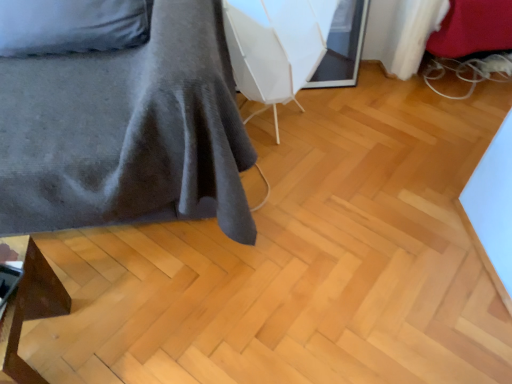
Question: Based on their positions, is velvet grey bedspread at left, the 1th furniture in the top-to-bottom sequence, located to the left or right of white plastic swivel chair at center?

Choices:
 (A) left
 (B) right

Answer: (A)

Question: Is velvet grey bedspread at left, positioned as the second furniture in bottom-to-top order, taller or shorter than white plastic swivel chair at center?

Choices:
 (A) tall
 (B) short

Answer: (A)

Question: Estimate the real-world distances between objects in this image. Which object is farther from the velvet grey bedspread at left, the 1th furniture in the top-to-bottom sequence?

Choices:
 (A) matte brown wooden stool at lower left, the first furniture ordered from the bottom
 (B) white plastic swivel chair at center

Answer: (A)

Question: Considering the real-world distances, which object is closest to the white plastic swivel chair at center?

Choices:
 (A) velvet grey bedspread at left, the 1th furniture in the top-to-bottom sequence
 (B) matte brown wooden stool at lower left, the first furniture ordered from the bottom

Answer: (A)